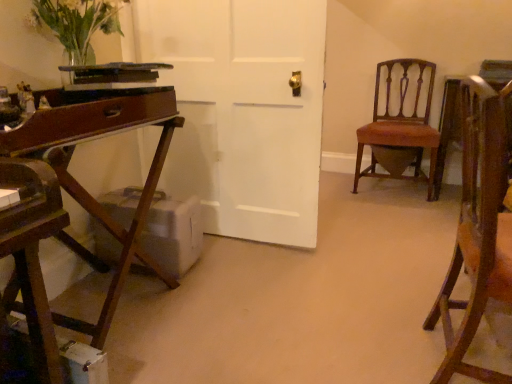
Where is `wooden desk at left`? The width and height of the screenshot is (512, 384). wooden desk at left is located at coordinates (80, 184).

Can you confirm if translucent glass vase at upper left is positioned to the left of wooden desk at left?

Yes, translucent glass vase at upper left is to the left of wooden desk at left.

What's the angular difference between translucent glass vase at upper left and wooden desk at left's facing directions?

1.74 degrees.

Considering the relative sizes of translucent glass vase at upper left and wooden desk at left in the image provided, is translucent glass vase at upper left bigger than wooden desk at left?

No, translucent glass vase at upper left is not bigger than wooden desk at left.

The width and height of the screenshot is (512, 384). In order to click on floral arrangement on the left of wooden desk at left in this screenshot , I will do `click(77, 24)`.

Is wooden desk at left positioned with its back to mahogany wood chair at right, the 2th chair positioned from the front?

No.

Who is shorter, wooden desk at left or mahogany wood chair at right, which is the 1th chair from back to front?

Standing shorter between the two is wooden desk at left.

Considering the positions of objects wooden desk at left and mahogany wood chair at right, the 2th chair positioned from the front, in the image provided, who is more to the right, wooden desk at left or mahogany wood chair at right, the 2th chair positioned from the front,?

Positioned to the right is mahogany wood chair at right, the 2th chair positioned from the front.

From the image's perspective, which one is positioned higher, wooden desk at left or mahogany wood chair at right, the 2th chair positioned from the front?

From the image's view, mahogany wood chair at right, the 2th chair positioned from the front, is above.

Can you tell me how much mahogany wood chair at right, the 2th chair positioned from the front, and wooden chair at right, positioned as the 1th chair in front-to-back order, differ in facing direction?

mahogany wood chair at right, the 2th chair positioned from the front, and wooden chair at right, positioned as the 1th chair in front-to-back order, are facing 95.9 degrees away from each other.

Is mahogany wood chair at right, which is the 1th chair from back to front, oriented towards wooden chair at right, which is the second chair from back to front?

Yes, mahogany wood chair at right, which is the 1th chair from back to front, is turned towards wooden chair at right, which is the second chair from back to front.

From the image's perspective, who appears lower, mahogany wood chair at right, the 2th chair positioned from the front, or wooden chair at right, which is the second chair from back to front?

wooden chair at right, which is the second chair from back to front, appears lower in the image.

Would you say mahogany wood chair at right, the 2th chair positioned from the front, is inside or outside wooden chair at right, which is the second chair from back to front?

mahogany wood chair at right, the 2th chair positioned from the front, exists outside the volume of wooden chair at right, which is the second chair from back to front.

Does point (84, 51) lie behind point (418, 176)?

No, (84, 51) is in front of (418, 176).

Is the position of translucent glass vase at upper left less distant than that of mahogany wood chair at right, the 2th chair positioned from the front?

Yes, it is.

From the image's perspective, between translucent glass vase at upper left and mahogany wood chair at right, the 2th chair positioned from the front, who is located below?

From the image's view, mahogany wood chair at right, the 2th chair positioned from the front, is below.

Is translucent glass vase at upper left situated inside mahogany wood chair at right, the 2th chair positioned from the front, or outside?

translucent glass vase at upper left exists outside the volume of mahogany wood chair at right, the 2th chair positioned from the front.

Is the position of wooden chair at right, positioned as the 1th chair in front-to-back order, more distant than that of translucent glass vase at upper left?

No, wooden chair at right, positioned as the 1th chair in front-to-back order, is closer to the viewer.

The height and width of the screenshot is (384, 512). I want to click on floral arrangement lying above the wooden chair at right, which is the second chair from back to front (from the image's perspective), so click(x=77, y=24).

Does wooden chair at right, which is the second chair from back to front, appear on the left side of translucent glass vase at upper left?

In fact, wooden chair at right, which is the second chair from back to front, is to the right of translucent glass vase at upper left.

From a real-world perspective, relative to translucent glass vase at upper left, is wooden chair at right, positioned as the 1th chair in front-to-back order, vertically above or below?

Clearly, from a real-world perspective, wooden chair at right, positioned as the 1th chair in front-to-back order, is below translucent glass vase at upper left.

Are wooden chair at right, which is the second chair from back to front, and mahogany wood chair at right, which is the 1th chair from back to front, beside each other?

No, wooden chair at right, which is the second chair from back to front, is not beside mahogany wood chair at right, which is the 1th chair from back to front.

Is wooden chair at right, which is the second chair from back to front, turned away from mahogany wood chair at right, the 2th chair positioned from the front?

No, mahogany wood chair at right, the 2th chair positioned from the front, is not at the back of wooden chair at right, which is the second chair from back to front.

Consider the image. From a real-world perspective, is wooden chair at right, positioned as the 1th chair in front-to-back order, above or below mahogany wood chair at right, which is the 1th chair from back to front?

wooden chair at right, positioned as the 1th chair in front-to-back order, is situated higher than mahogany wood chair at right, which is the 1th chair from back to front, in the real world.

Does wooden chair at right, which is the second chair from back to front, have a greater height compared to mahogany wood chair at right, which is the 1th chair from back to front?

Correct, wooden chair at right, which is the second chair from back to front, is much taller as mahogany wood chair at right, which is the 1th chair from back to front.

Considering the sizes of objects mahogany wood chair at right, which is the 1th chair from back to front, and translucent glass vase at upper left in the image provided, who is thinner, mahogany wood chair at right, which is the 1th chair from back to front, or translucent glass vase at upper left?

translucent glass vase at upper left.

Does mahogany wood chair at right, the 2th chair positioned from the front, lie in front of translucent glass vase at upper left?

No, mahogany wood chair at right, the 2th chair positioned from the front, is further to the viewer.

Could you tell me if mahogany wood chair at right, the 2th chair positioned from the front, is turned towards translucent glass vase at upper left?

No, mahogany wood chair at right, the 2th chair positioned from the front, is not oriented towards translucent glass vase at upper left.

Does mahogany wood chair at right, the 2th chair positioned from the front, appear on the right side of translucent glass vase at upper left?

Indeed, mahogany wood chair at right, the 2th chair positioned from the front, is positioned on the right side of translucent glass vase at upper left.

The width and height of the screenshot is (512, 384). Identify the location of desk in front of the translucent glass vase at upper left. (80, 184).

Identify the location of desk located below the mahogany wood chair at right, the 2th chair positioned from the front (from the image's perspective). (80, 184).

In the scene shown: Based on their spatial positions, is mahogany wood chair at right, the 2th chair positioned from the front, or translucent glass vase at upper left closer to wooden desk at left?

translucent glass vase at upper left is positioned closer to the anchor wooden desk at left.

Based on their spatial positions, is translucent glass vase at upper left or mahogany wood chair at right, the 2th chair positioned from the front, closer to wooden desk at left?

translucent glass vase at upper left is closer to wooden desk at left.

Based on their spatial positions, is wooden chair at right, which is the second chair from back to front, or translucent glass vase at upper left further from wooden desk at left?

The object further to wooden desk at left is wooden chair at right, which is the second chair from back to front.

Looking at the image, which one is located closer to wooden chair at right, positioned as the 1th chair in front-to-back order, wooden desk at left or mahogany wood chair at right, the 2th chair positioned from the front?

Among the two, wooden desk at left is located nearer to wooden chair at right, positioned as the 1th chair in front-to-back order.

From the image, which object appears to be farther from mahogany wood chair at right, the 2th chair positioned from the front, wooden chair at right, which is the second chair from back to front, or wooden desk at left?

wooden desk at left lies further to mahogany wood chair at right, the 2th chair positioned from the front, than the other object.

Looking at this image, considering their positions, is wooden chair at right, which is the second chair from back to front, positioned further to mahogany wood chair at right, which is the 1th chair from back to front, than translucent glass vase at upper left?

translucent glass vase at upper left lies further to mahogany wood chair at right, which is the 1th chair from back to front, than the other object.

From the image, which object appears to be farther from wooden chair at right, positioned as the 1th chair in front-to-back order, mahogany wood chair at right, the 2th chair positioned from the front, or translucent glass vase at upper left?

The object further to wooden chair at right, positioned as the 1th chair in front-to-back order, is mahogany wood chair at right, the 2th chair positioned from the front.

Considering their positions, is wooden desk at left positioned further to mahogany wood chair at right, the 2th chair positioned from the front, than translucent glass vase at upper left?

translucent glass vase at upper left is further to mahogany wood chair at right, the 2th chair positioned from the front.

The width and height of the screenshot is (512, 384). I want to click on floral arrangement positioned between wooden chair at right, which is the second chair from back to front, and mahogany wood chair at right, which is the 1th chair from back to front, from near to far, so click(77, 24).

You are a GUI agent. You are given a task and a screenshot of the screen. Output one action in this format:
    pyautogui.click(x=<x>, y=<y>)
    Task: Click on the desk between wooden chair at right, which is the second chair from back to front, and mahogany wood chair at right, the 2th chair positioned from the front, in the front-back direction
    
    Given the screenshot: What is the action you would take?
    pyautogui.click(x=80, y=184)

This screenshot has height=384, width=512. What are the coordinates of `desk between translucent glass vase at upper left and wooden chair at right, positioned as the 1th chair in front-to-back order, in the horizontal direction` in the screenshot? It's located at click(x=80, y=184).

The height and width of the screenshot is (384, 512). I want to click on desk between translucent glass vase at upper left and mahogany wood chair at right, which is the 1th chair from back to front, so click(80, 184).